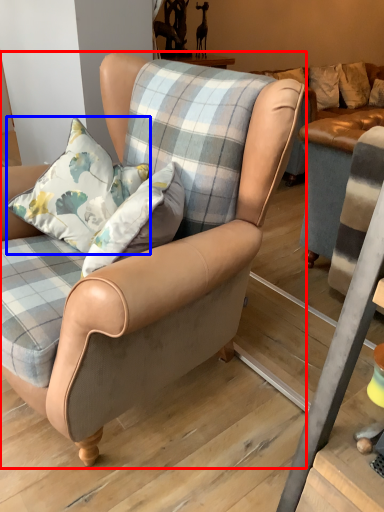
Question: Which of the following is the farthest to the observer, chair (highlighted by a red box) or pillow (highlighted by a blue box)?

Choices:
 (A) chair
 (B) pillow

Answer: (B)